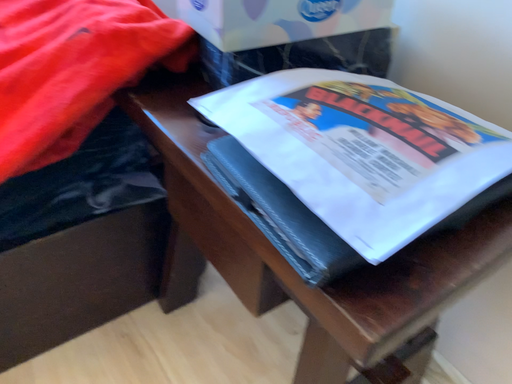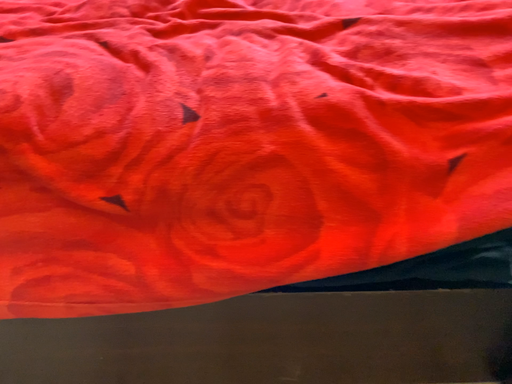
Question: How did the camera likely rotate when shooting the video?

Choices:
 (A) rotated downward
 (B) rotated upward

Answer: (B)